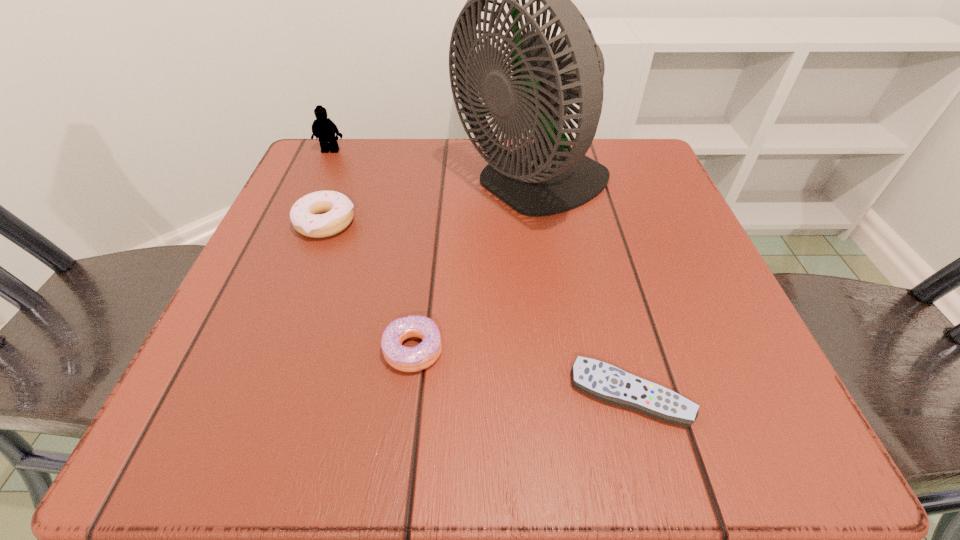
I want to click on vacant space in between the nearer doughnut and the fourth shortest object, so 372,250.

The image size is (960, 540). Identify the location of empty location between the left doughnut and the shortest object. (x=478, y=308).

This screenshot has width=960, height=540. I want to click on vacant area that lies between the fan and the farther doughnut, so click(x=429, y=205).

Image resolution: width=960 pixels, height=540 pixels. In order to click on free spot between the fan and the farther doughnut in this screenshot , I will do `click(429, 205)`.

Locate an element on the screen. This screenshot has height=540, width=960. vacant area that lies between the left doughnut and the Lego is located at coordinates (328, 186).

Where is `vacant space that's between the fan and the farther doughnut`? vacant space that's between the fan and the farther doughnut is located at coordinates (429, 205).

This screenshot has height=540, width=960. In order to click on free spot between the second tallest object and the tallest object in this screenshot , I will do click(x=431, y=169).

I want to click on vacant region between the nearer doughnut and the shortest object, so click(522, 372).

Select which object appears as the second closest to the nearer doughnut. Please provide its 2D coordinates. Your answer should be formatted as a tuple, i.e. [(x, y)], where the tuple contains the x and y coordinates of a point satisfying the conditions above.

[(546, 177)]

Locate an element on the screen. Image resolution: width=960 pixels, height=540 pixels. the second closest object to the fourth shortest object is located at coordinates coord(546,177).